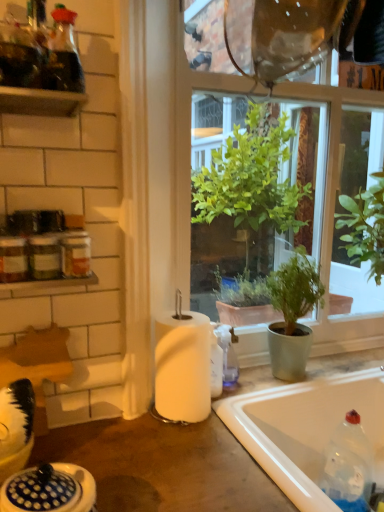
Question: Is green matte plant at center far away from matte white countertop at center?

Choices:
 (A) yes
 (B) no

Answer: (B)

Question: Is the depth of green matte plant at center less than that of matte white countertop at center?

Choices:
 (A) yes
 (B) no

Answer: (B)

Question: From a real-world perspective, is green matte plant at center physically below matte white countertop at center?

Choices:
 (A) no
 (B) yes

Answer: (A)

Question: Is green matte plant at center to the left of matte white countertop at center from the viewer's perspective?

Choices:
 (A) yes
 (B) no

Answer: (B)

Question: Can you confirm if green matte plant at center is positioned to the right of matte white countertop at center?

Choices:
 (A) no
 (B) yes

Answer: (B)

Question: Is green matte plant at center behind matte white countertop at center?

Choices:
 (A) no
 (B) yes

Answer: (B)

Question: Does white glossy sink at lower left come in front of green matte plant at center?

Choices:
 (A) yes
 (B) no

Answer: (A)

Question: From a real-world perspective, is white glossy sink at lower left below green matte plant at center?

Choices:
 (A) yes
 (B) no

Answer: (A)

Question: Is white glossy sink at lower left smaller than green matte plant at center?

Choices:
 (A) no
 (B) yes

Answer: (B)

Question: From the image's perspective, is white glossy sink at lower left above green matte plant at center?

Choices:
 (A) yes
 (B) no

Answer: (B)

Question: Is white glossy sink at lower left to the left of green matte plant at center from the viewer's perspective?

Choices:
 (A) yes
 (B) no

Answer: (A)

Question: Is white glossy sink at lower left further to camera compared to green matte plant at center?

Choices:
 (A) yes
 (B) no

Answer: (B)

Question: From a real-world perspective, is white matte paper towel at center located higher than transparent glass window at center?

Choices:
 (A) yes
 (B) no

Answer: (B)